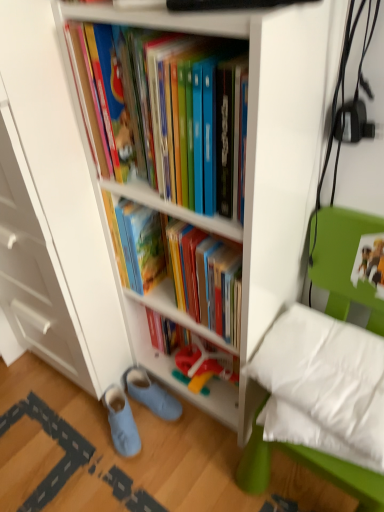
Identify the location of free location in front of blue suede slippers at lower left, the 1th footwear positioned from the right. Image resolution: width=384 pixels, height=512 pixels. (155, 461).